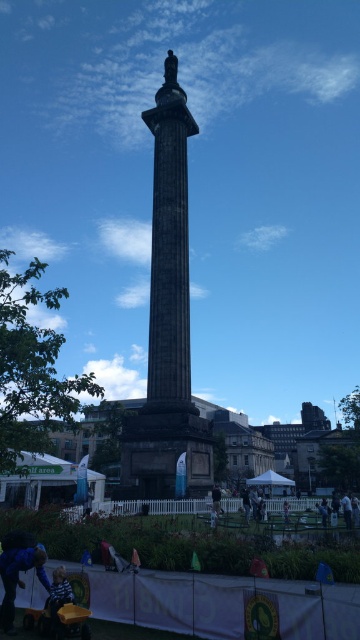
Question: Does blue denim jacket at lower left have a greater width compared to light blue denim jacket at lower left?

Choices:
 (A) no
 (B) yes

Answer: (A)

Question: Which point is closer to the camera taking this photo?

Choices:
 (A) [155, 166]
 (B) [347, 522]

Answer: (B)

Question: Does black stone column at center have a larger size compared to yellow plastic baby carriage at lower left?

Choices:
 (A) no
 (B) yes

Answer: (B)

Question: Considering the real-world distances, which object is closest to the dark blue fabric at center?

Choices:
 (A) light blue denim jacket at lower left
 (B) yellow plastic baby carriage at lower left
 (C) black stone column at center
 (D) dark blue jeans at lower center

Answer: (D)

Question: Can you confirm if yellow plastic baby carriage at lower left is positioned below light blue denim jacket at lower left?

Choices:
 (A) no
 (B) yes

Answer: (B)

Question: Which point is farther to the camera?

Choices:
 (A) (348, 518)
 (B) (43, 548)
 (C) (52, 612)

Answer: (A)